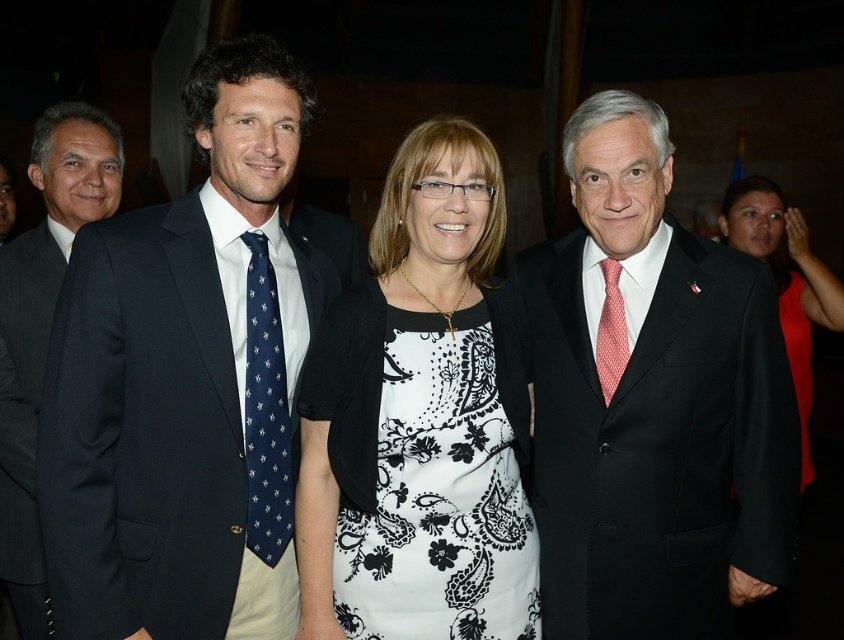
Question: Does dark blue suit at left have a greater width compared to navy silk tie at left?

Choices:
 (A) no
 (B) yes

Answer: (B)

Question: Which point is closer to the camera taking this photo?

Choices:
 (A) (675, 547)
 (B) (269, 547)

Answer: (B)

Question: Is white printed fabric dress at center positioned behind navy silk tie at left?

Choices:
 (A) yes
 (B) no

Answer: (B)

Question: Which of the following is the closest to the observer?

Choices:
 (A) white printed fabric dress at center
 (B) black satin dress at center

Answer: (A)

Question: Is black suit at center positioned behind dark blue suit at left?

Choices:
 (A) no
 (B) yes

Answer: (A)

Question: Among these objects, which one is nearest to the camera?

Choices:
 (A) white printed fabric dress at center
 (B) black satin dress at center
 (C) red dotted tie at right

Answer: (A)